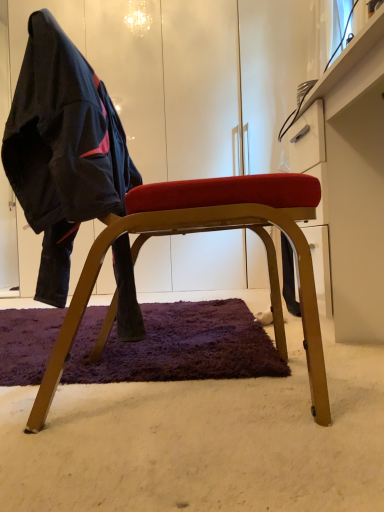
Question: In terms of width, does wooden chair at center look wider or thinner when compared to matte black jacket at left?

Choices:
 (A) thin
 (B) wide

Answer: (B)

Question: Considering the positions of wooden chair at center and matte black jacket at left in the image, is wooden chair at center taller or shorter than matte black jacket at left?

Choices:
 (A) tall
 (B) short

Answer: (A)

Question: Estimate the real-world distances between objects in this image. Which object is closer to the white glossy dresser at upper right?

Choices:
 (A) matte black jacket at left
 (B) wooden chair at center

Answer: (B)

Question: Which object is the closest to the matte black jacket at left?

Choices:
 (A) white glossy dresser at upper right
 (B) wooden chair at center

Answer: (B)